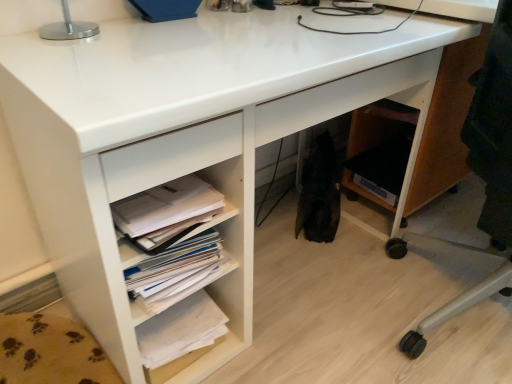
I want to click on free point above white paper stack at lower left, which appears as the second book when viewed from the top (from a real-world perspective), so click(181, 326).